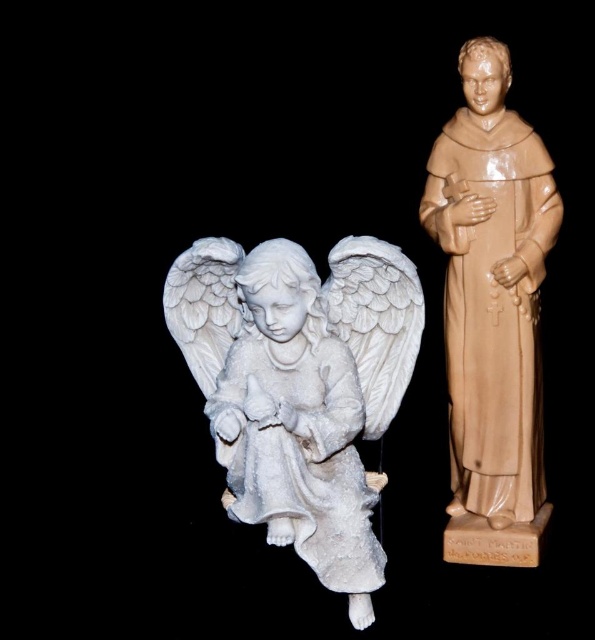
In the scene shown: You are an art curator planning to display the white marble angel at left and the matte beige statue at right in a gallery. Based on their sizes, which statue would require a taller base to ensure proper visibility for visitors?

The matte beige statue at right requires a taller base because it has a greater height than the white marble angel at left, as stated in the description.

Looking at this image, you are an art curator arranging a gallery exhibit. You need to determine the spatial relationship between the white marble angel at left and the matte beige statue at right as seen from the gallery entrance. Which statue is closer to the entrance?

The white marble angel at left is closer to the entrance because it is positioned in front of the matte beige statue at right.

You are an art curator arranging a gallery exhibition. You need to place a new sculpture exactly between the white marble angel at left and the matte beige statue at right. Given their widths, which statue should be positioned closer to the center of the gallery to ensure the sculpture is centered properly?

The white marble angel at left is wider than the matte beige statue at right. To center the new sculpture between them, the wider white marble angel at left should be positioned closer to the center so that the sculpture can be placed equidistant from both statues.